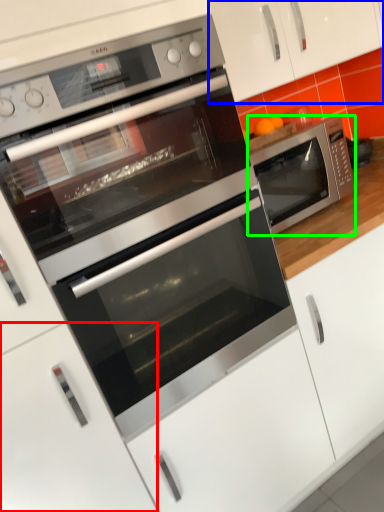
Question: Estimate the real-world distances between objects in this image. Which object is farther from drawer (highlighted by a red box), cabinetry (highlighted by a blue box) or microwave oven (highlighted by a green box)?

Choices:
 (A) cabinetry
 (B) microwave oven

Answer: (A)